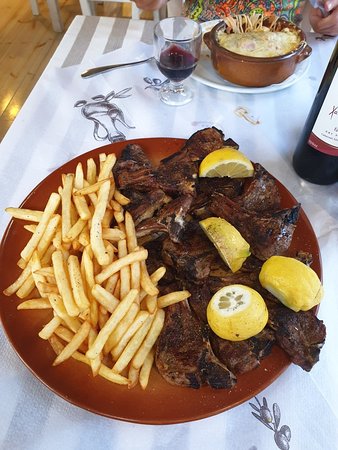
You are a GUI agent. You are given a task and a screenshot of the screen. Output one action in this format:
    pyautogui.click(x=<x>, y=<y>)
    Task: Click on the table
    The width and height of the screenshot is (338, 450).
    Given the screenshot: What is the action you would take?
    coord(292,394)